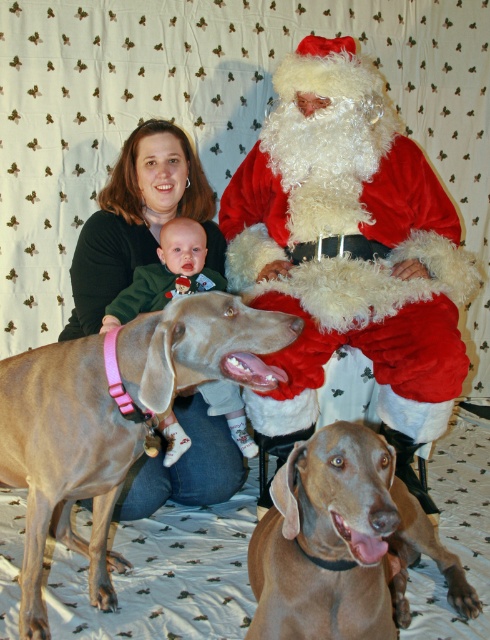
You are planning to place a small gift box between the velvet santa claus at center and the soft pink fabric baby at center. Based on their widths, will the gift box fit between them?

The velvet santa claus at center might be wider than the soft pink fabric baby at center, so there may not be enough space for the gift box between them. Check the actual dimensions before placing the gift box.

You are a photographer trying to capture a clear shot of the brown smooth coat at lower center without the smooth tan dog at center blocking it. What adjustment should you make to your camera position?

The brown smooth coat at lower center is behind the smooth tan dog at center, so you should move your camera position forward to get a closer shot, ensuring the smooth tan dog at center is not blocking the view of the brown smooth coat at lower center.

You are a photographer setting up for a family photo. You need to place a small prop between the smooth tan dog at center and the brown smooth coat at lower center. The prop requires at least 16 inches of space to fit. Based on the scene description, will there be enough space between them?

The smooth tan dog at center and brown smooth coat at lower center are 15.13 inches apart from each other. Since the required space is 16 inches, there is not enough space to place the prop between them.